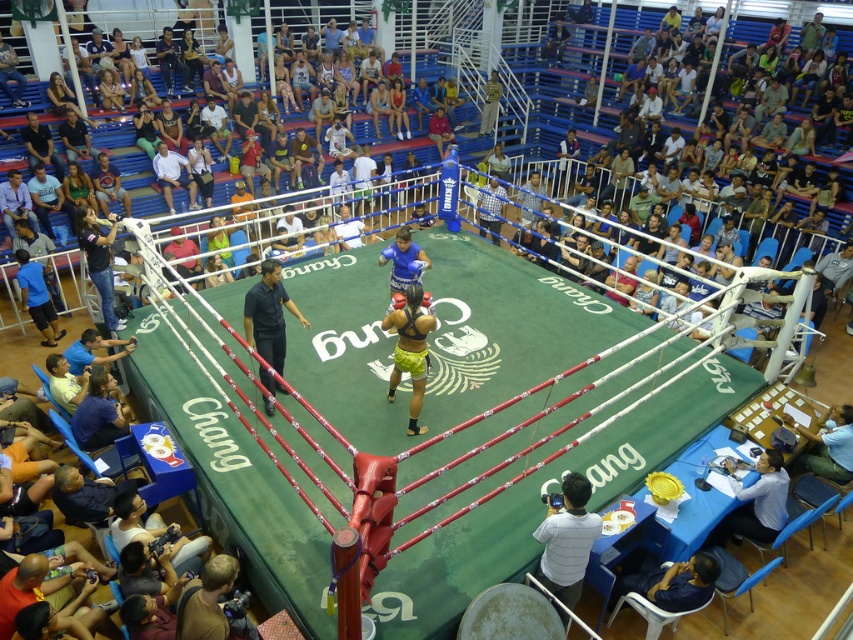
Does point (572, 545) come closer to viewer compared to point (190, 198)?

Yes, it is.

Is white cotton camera at lower center taller than white cotton shirt at upper left?

No, white cotton camera at lower center is not taller than white cotton shirt at upper left.

What do you see at coordinates (567, 540) in the screenshot? I see `white cotton camera at lower center` at bounding box center [567, 540].

This screenshot has width=853, height=640. I want to click on white cotton camera at lower center, so click(x=567, y=540).

Which is below, black smooth shirt at center or white cotton shirt at upper left?

black smooth shirt at center is lower down.

Which is in front, point (299, 314) or point (173, 172)?

Point (299, 314)

The height and width of the screenshot is (640, 853). I want to click on black smooth shirt at center, so click(x=268, y=314).

At what (x,y) coordinates should I click in order to perform the action: click on black smooth shirt at center. Please return your answer as a coordinate pair (x, y). Looking at the image, I should click on (268, 314).

Looking at this image, between white cotton camera at lower center and yellow fabric shorts at center, which one is positioned lower?

white cotton camera at lower center is lower down.

Is white cotton camera at lower center positioned before yellow fabric shorts at center?

Yes, it is.

Between point (555, 582) and point (415, 424), which one is positioned in front?

Point (555, 582)

Identify the location of white cotton camera at lower center. (567, 540).